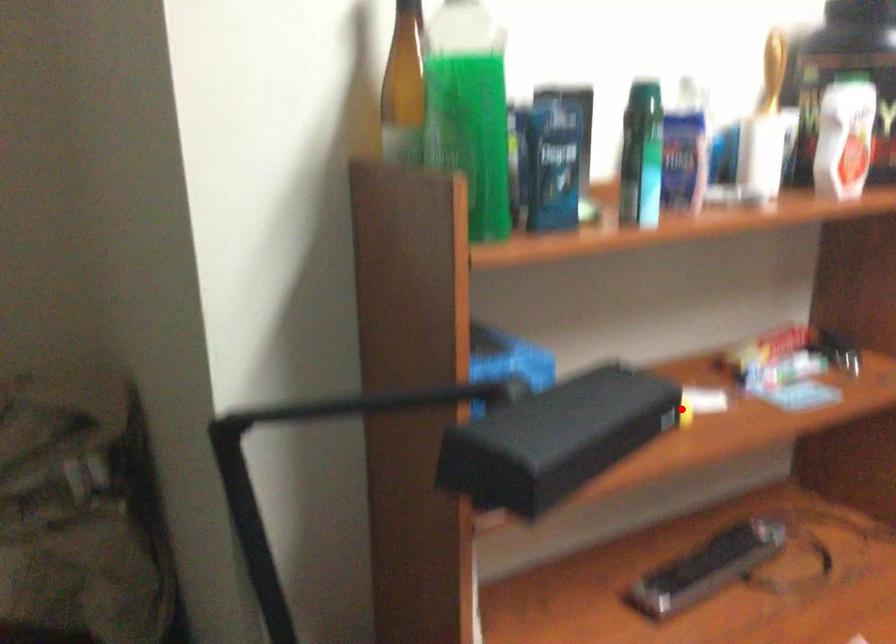
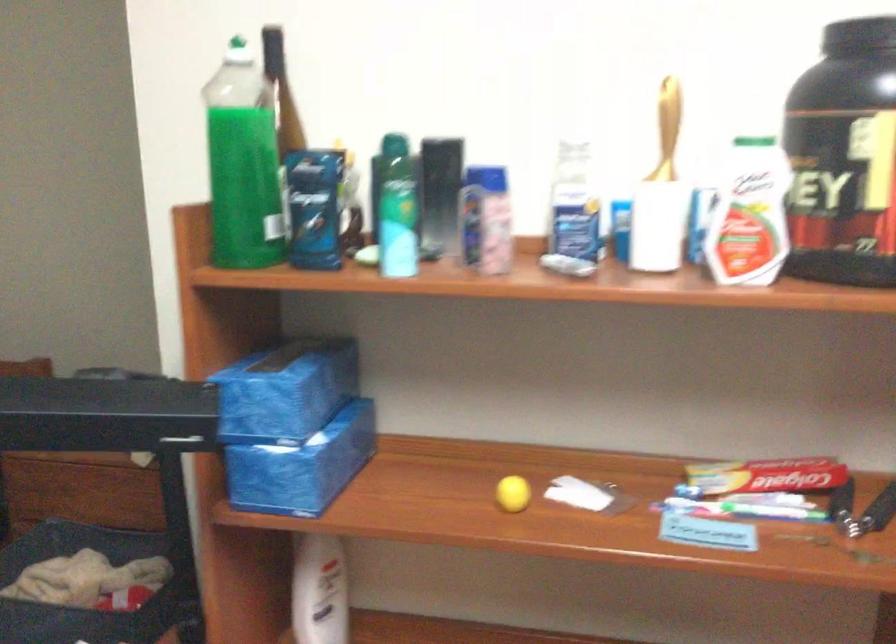
Where in the second image is the point corresponding to the highlighted location from the first image?

(513, 494)